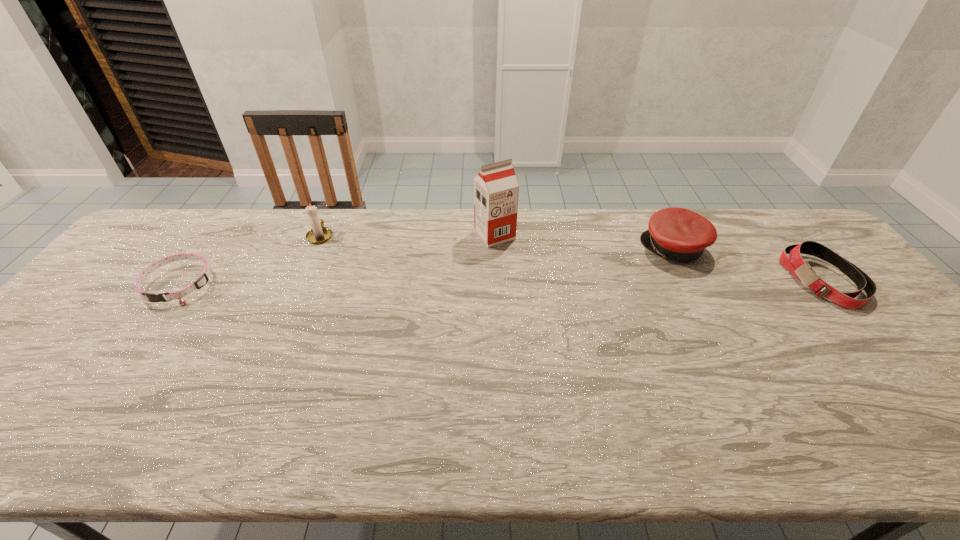
You are a GUI agent. You are given a task and a screenshot of the screen. Output one action in this format:
    pyautogui.click(x=<x>, y=<y>)
    Task: Click on the candle holder at the far edge
    The image size is (960, 540).
    Given the screenshot: What is the action you would take?
    pyautogui.click(x=319, y=234)

Identify the location of cap that is at the far edge. This screenshot has height=540, width=960. (679, 234).

Locate an element on the screen. object positioned at the left edge is located at coordinates (203, 278).

Where is `object at the right edge`? object at the right edge is located at coordinates (794, 263).

Locate an element on the screen. vacant region at the far edge of the desktop is located at coordinates (207, 242).

You are a GUI agent. You are given a task and a screenshot of the screen. Output one action in this format:
    pyautogui.click(x=<x>, y=<y>)
    Task: Click on the free space at the near edge of the desktop
    This screenshot has width=960, height=540.
    Given the screenshot: What is the action you would take?
    pyautogui.click(x=676, y=437)

Where is `vacant space at the left edge of the desktop`? vacant space at the left edge of the desktop is located at coordinates (117, 286).

The height and width of the screenshot is (540, 960). Find the location of `vacant space at the right edge of the desktop`. vacant space at the right edge of the desktop is located at coordinates (935, 391).

Locate an element on the screen. free space at the far left corner of the desktop is located at coordinates (140, 253).

The width and height of the screenshot is (960, 540). What are the coordinates of `vacant region between the shorter dog collar and the tallest object` in the screenshot? It's located at (337, 260).